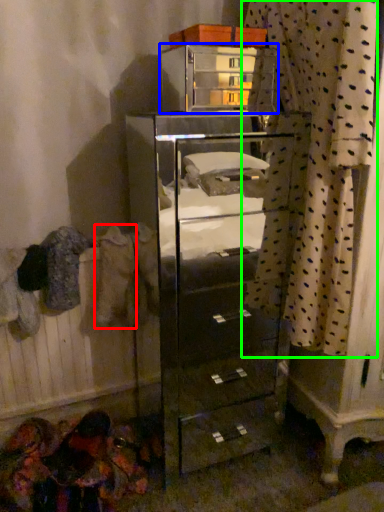
Question: Based on their relative distances, which object is farther from clothing (highlighted by a red box)? Choose from furniture (highlighted by a blue box) and curtain (highlighted by a green box).

Choices:
 (A) furniture
 (B) curtain

Answer: (A)